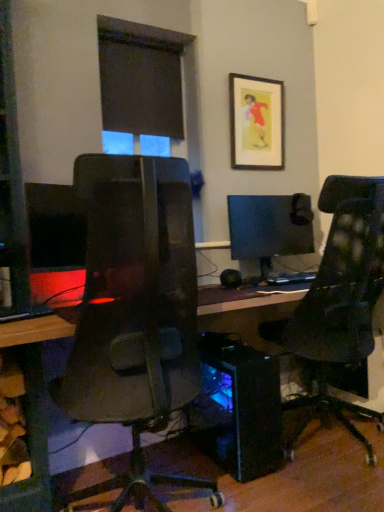
The image size is (384, 512). What do you see at coordinates (246, 408) in the screenshot? I see `transparent blue computer tower at center` at bounding box center [246, 408].

Locate an element on the screen. Image resolution: width=384 pixels, height=512 pixels. matte black monitor at left, the first computer monitor in the left-to-right sequence is located at coordinates (55, 227).

What do you see at coordinates (256, 123) in the screenshot? This screenshot has height=512, width=384. I see `wooden framed picture at upper center` at bounding box center [256, 123].

Where is `transparent blue computer tower at center`? transparent blue computer tower at center is located at coordinates (246, 408).

Between matte black monitor at left, the 2th computer monitor positioned from the right, and transparent blue computer tower at center, which one appears on the left side from the viewer's perspective?

matte black monitor at left, the 2th computer monitor positioned from the right, is more to the left.

Between point (47, 190) and point (259, 426), which one is positioned in front?

The point (47, 190) is closer.

Do you think matte black monitor at left, the first computer monitor in the left-to-right sequence, is within transparent blue computer tower at center, or outside of it?

The correct answer is: outside.

The height and width of the screenshot is (512, 384). In order to click on computer tower that appears below the matte black monitor at left, the first computer monitor in the left-to-right sequence (from a real-world perspective) in this screenshot , I will do `click(246, 408)`.

From the image's perspective, which one is positioned higher, transparent blue computer tower at center or wooden framed picture at upper center?

wooden framed picture at upper center appears higher in the image.

Image resolution: width=384 pixels, height=512 pixels. In order to click on computer tower on the left of wooden framed picture at upper center in this screenshot , I will do `click(246, 408)`.

Which of these two, transparent blue computer tower at center or wooden framed picture at upper center, stands taller?

With more height is wooden framed picture at upper center.

Based on the photo, which is more to the left, transparent blue computer tower at center or wooden framed picture at upper center?

transparent blue computer tower at center is more to the left.

At what (x,y) coordinates should I click in order to perform the action: click on the 2nd computer monitor below the wooden framed picture at upper center (from a real-world perspective). Please return your answer as a coordinate pair (x, y). The height and width of the screenshot is (512, 384). Looking at the image, I should click on (269, 227).

Is matte black monitor at center, the 1th computer monitor positioned from the right, facing away from wooden framed picture at upper center?

No.

Is matte black monitor at center, the 2th computer monitor viewed from the left, with wooden framed picture at upper center?

No.

What's the angular difference between matte black monitor at left, the first computer monitor in the left-to-right sequence, and wooden framed picture at upper center's facing directions?

The angle between the facing direction of matte black monitor at left, the first computer monitor in the left-to-right sequence, and the facing direction of wooden framed picture at upper center is 0.00555 degrees.

Based on the photo, considering the relative positions of matte black monitor at left, the first computer monitor in the left-to-right sequence, and wooden framed picture at upper center in the image provided, is matte black monitor at left, the first computer monitor in the left-to-right sequence, to the left or to the right of wooden framed picture at upper center?

matte black monitor at left, the first computer monitor in the left-to-right sequence, is to the left of wooden framed picture at upper center.

How much distance is there between matte black monitor at left, which appears as the 1th computer monitor when viewed from the front, and wooden framed picture at upper center?

matte black monitor at left, which appears as the 1th computer monitor when viewed from the front, is 1.23 meters from wooden framed picture at upper center.

This screenshot has width=384, height=512. I want to click on the 2nd computer monitor in front of the wooden framed picture at upper center, starting your count from the anchor, so click(55, 227).

From a real-world perspective, is matte black monitor at center, which ranks as the 2th computer monitor in front-to-back order, beneath matte black monitor at left, the first computer monitor in the left-to-right sequence?

Yes, from a real-world perspective, matte black monitor at center, which ranks as the 2th computer monitor in front-to-back order, is under matte black monitor at left, the first computer monitor in the left-to-right sequence.

Would you consider matte black monitor at center, the 1th computer monitor positioned from the right, to be distant from matte black monitor at left, the first computer monitor in the left-to-right sequence?

matte black monitor at center, the 1th computer monitor positioned from the right, is positioned a significant distance from matte black monitor at left, the first computer monitor in the left-to-right sequence.

Measure the distance from matte black monitor at center, the 2th computer monitor viewed from the left, to matte black monitor at left, placed as the 2th computer monitor when sorted from back to front.

They are 1.08 meters apart.

Looking at this image, how different are the orientations of matte black monitor at center, which ranks as the 2th computer monitor in front-to-back order, and matte black monitor at left, the 2th computer monitor positioned from the right, in degrees?

The angular difference between matte black monitor at center, which ranks as the 2th computer monitor in front-to-back order, and matte black monitor at left, the 2th computer monitor positioned from the right, is 0.0066 degrees.

Considering the relative sizes of matte black monitor at left, the 2th computer monitor positioned from the right, and matte black monitor at center, the 2th computer monitor viewed from the left, in the image provided, is matte black monitor at left, the 2th computer monitor positioned from the right, wider than matte black monitor at center, the 2th computer monitor viewed from the left,?

Yes.

From a real-world perspective, is matte black monitor at left, which appears as the 1th computer monitor when viewed from the front, physically below matte black monitor at center, the 1th computer monitor positioned from the right?

Incorrect, from a real-world perspective, matte black monitor at left, which appears as the 1th computer monitor when viewed from the front, is higher than matte black monitor at center, the 1th computer monitor positioned from the right.

Which is in front, point (62, 249) or point (242, 239)?

The point (62, 249) is closer to the camera.

Is matte black monitor at left, placed as the 2th computer monitor when sorted from back to front, positioned with its back to matte black monitor at center, which ranks as the 2th computer monitor in front-to-back order?

matte black monitor at left, placed as the 2th computer monitor when sorted from back to front, is not turned away from matte black monitor at center, which ranks as the 2th computer monitor in front-to-back order.

Can you tell me how much wooden framed picture at upper center and matte black monitor at center, which ranks as the 2th computer monitor in front-to-back order, differ in facing direction?

0.00112 degrees.

Which is closer to the camera, (x=238, y=111) or (x=305, y=213)?

Point (x=238, y=111).

Is wooden framed picture at upper center bigger than matte black monitor at center, the 2th computer monitor viewed from the left?

No, wooden framed picture at upper center is not bigger than matte black monitor at center, the 2th computer monitor viewed from the left.

What are the coordinates of `picture frame positioned vertically above the matte black monitor at center, the 2th computer monitor viewed from the left (from a real-world perspective)` in the screenshot? It's located at (256, 123).

The image size is (384, 512). Find the location of `the 1st computer monitor above the transparent blue computer tower at center (from the image's perspective)`. the 1st computer monitor above the transparent blue computer tower at center (from the image's perspective) is located at coordinates (55, 227).

What are the coordinates of `picture frame that appears behind the transparent blue computer tower at center` in the screenshot? It's located at (256, 123).

Considering their positions, is transparent blue computer tower at center positioned closer to matte black monitor at center, the 2th computer monitor viewed from the left, than matte black monitor at left, the first computer monitor in the left-to-right sequence?

transparent blue computer tower at center is positioned closer to the anchor matte black monitor at center, the 2th computer monitor viewed from the left.

Based on their spatial positions, is matte black monitor at center, the 2th computer monitor viewed from the left, or matte black monitor at left, placed as the 2th computer monitor when sorted from back to front, further from wooden framed picture at upper center?

Among the two, matte black monitor at left, placed as the 2th computer monitor when sorted from back to front, is located further to wooden framed picture at upper center.

Estimate the real-world distances between objects in this image. Which object is further from matte black monitor at left, which appears as the 1th computer monitor when viewed from the front, transparent blue computer tower at center or matte black monitor at center, the 2th computer monitor viewed from the left?

The object further to matte black monitor at left, which appears as the 1th computer monitor when viewed from the front, is matte black monitor at center, the 2th computer monitor viewed from the left.

Estimate the real-world distances between objects in this image. Which object is further from transparent blue computer tower at center, matte black monitor at left, which appears as the 1th computer monitor when viewed from the front, or matte black monitor at center, the 1th computer monitor positioned from the right?

Among the two, matte black monitor at left, which appears as the 1th computer monitor when viewed from the front, is located further to transparent blue computer tower at center.

From the image, which object appears to be farther from wooden framed picture at upper center, transparent blue computer tower at center or matte black monitor at center, the first computer monitor positioned from the back?

transparent blue computer tower at center.

Which object lies nearer to the anchor point transparent blue computer tower at center, wooden framed picture at upper center or matte black monitor at center, the 2th computer monitor viewed from the left?

matte black monitor at center, the 2th computer monitor viewed from the left.

Which object lies further to the anchor point matte black monitor at left, placed as the 2th computer monitor when sorted from back to front, wooden framed picture at upper center or transparent blue computer tower at center?

The object further to matte black monitor at left, placed as the 2th computer monitor when sorted from back to front, is wooden framed picture at upper center.

Estimate the real-world distances between objects in this image. Which object is further from matte black monitor at center, the 2th computer monitor viewed from the left, transparent blue computer tower at center or wooden framed picture at upper center?

transparent blue computer tower at center.

Find the location of a particular element. The width and height of the screenshot is (384, 512). computer tower between matte black monitor at left, the first computer monitor in the left-to-right sequence, and matte black monitor at center, which ranks as the 2th computer monitor in front-to-back order, from left to right is located at coordinates (246, 408).

This screenshot has height=512, width=384. I want to click on picture frame located between matte black monitor at left, which appears as the 1th computer monitor when viewed from the front, and matte black monitor at center, which ranks as the 2th computer monitor in front-to-back order, in the left-right direction, so click(x=256, y=123).